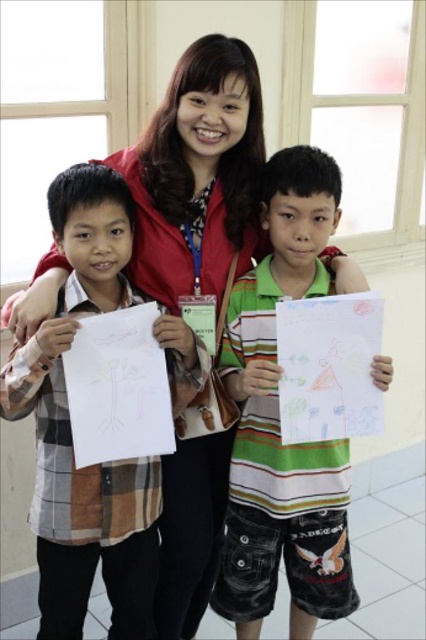
You are organizing a classroom activity and need to arrange two pieces of paper for a project. You have a colored paper at center and a white paper at left. Based on their positions, which paper is more to the left?

The white paper at left is more to the left since the colored paper at center is positioned on the right side of it.